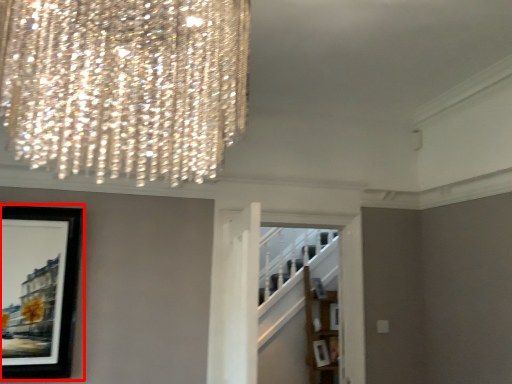
Question: From the image's perspective, what is the correct spatial positioning of picture frame (annotated by the red box) in reference to shelf?

Choices:
 (A) above
 (B) below

Answer: (A)